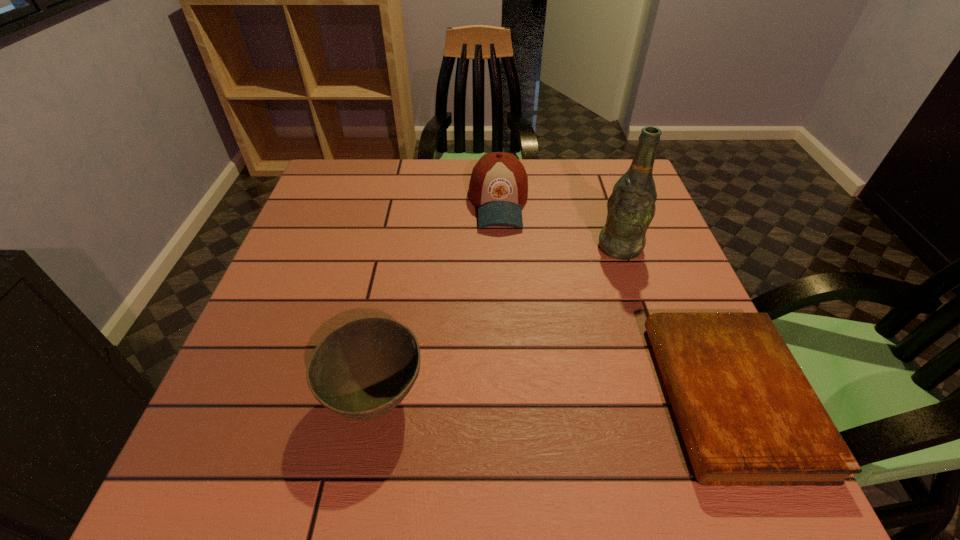
Where is `free space on the desktop that is between the bowl and the shortest object and is positioned on the surface of the beer bottle`? This screenshot has width=960, height=540. free space on the desktop that is between the bowl and the shortest object and is positioned on the surface of the beer bottle is located at coordinates (510, 397).

Identify the location of free space on the desktop that is between the leftmost object and the shortest object and is positioned on the front-facing side of the baseball cap. (511, 397).